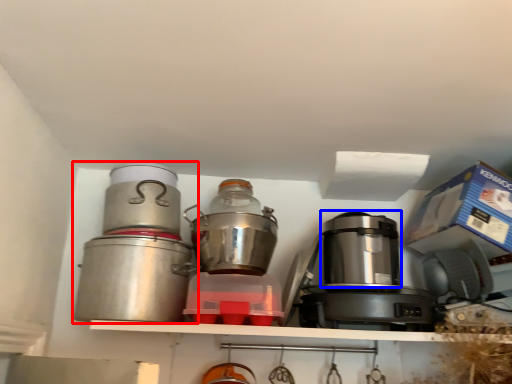
Question: Which of the following is the closest to the observer, kitchen appliance (highlighted by a red box) or appliance (highlighted by a blue box)?

Choices:
 (A) kitchen appliance
 (B) appliance

Answer: (A)